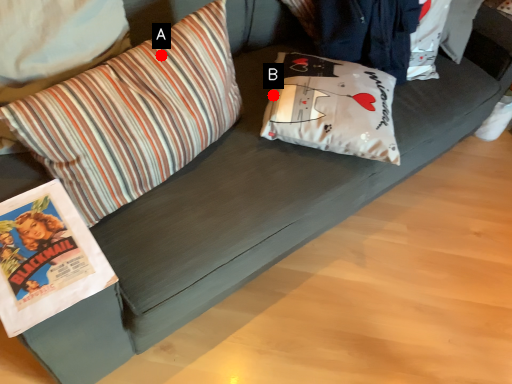
Question: Two points are circled on the image, labeled by A and B beside each circle. Which point is closer to the camera?

Choices:
 (A) A is closer
 (B) B is closer

Answer: (A)